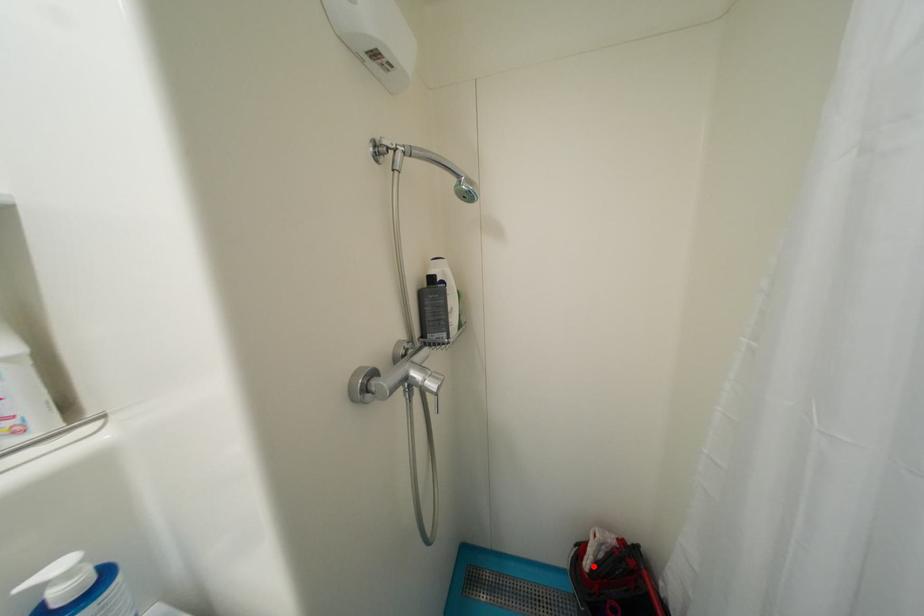
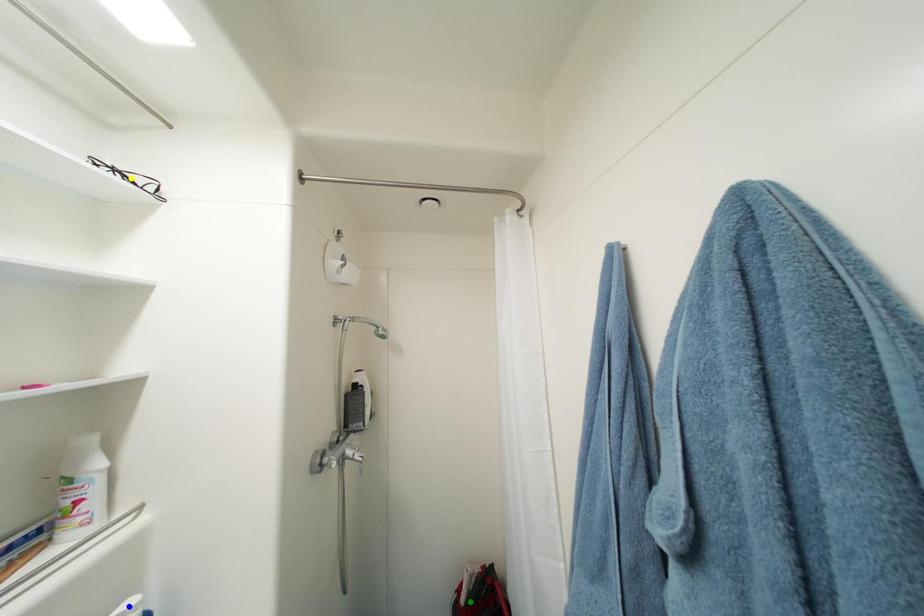
Question: I am providing you with two images of the same scene from different viewpoints. A red point is marked on the first image. You are given multiple points on the second image. Which spot in image 2 lines up with the point in image 1?

Choices:
 (A) blue point
 (B) yellow point
 (C) green point

Answer: (C)